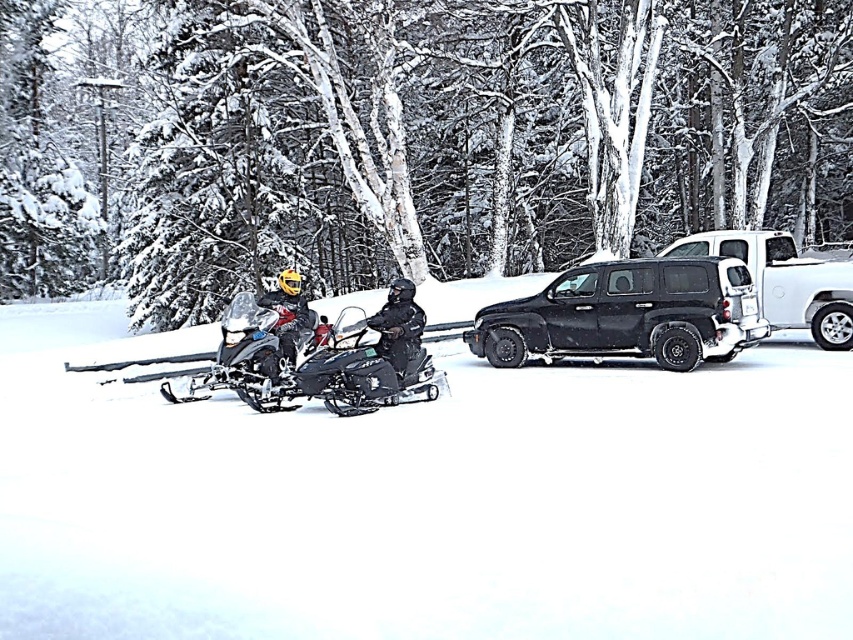
Is black matte suv at center taller than white glossy trailer truck at center right?

Incorrect, black matte suv at center's height is not larger of white glossy trailer truck at center right's.

Does point (515, 314) lie behind point (761, 308)?

That is False.

Locate an element on the screen. The height and width of the screenshot is (640, 853). black matte suv at center is located at coordinates (627, 314).

From the picture: Does shiny black snowmobile at center have a greater width compared to matte black snowmobile at center?

No, shiny black snowmobile at center is not wider than matte black snowmobile at center.

Is point (397, 380) in front of point (287, 364)?

That is True.

Is point (335, 371) closer to camera compared to point (286, 268)?

Yes, point (335, 371) is closer to viewer.

Image resolution: width=853 pixels, height=640 pixels. I want to click on shiny black snowmobile at center, so 364,369.

Does shiny silver snowmobile at center have a lesser height compared to matte black snowmobile at center?

Yes.

Can you confirm if shiny silver snowmobile at center is thinner than matte black snowmobile at center?

Indeed, shiny silver snowmobile at center has a lesser width compared to matte black snowmobile at center.

At what (x,y) coordinates should I click in order to perform the action: click on shiny silver snowmobile at center. Please return your answer as a coordinate pair (x, y). Looking at the image, I should click on (334, 358).

You are a GUI agent. You are given a task and a screenshot of the screen. Output one action in this format:
    pyautogui.click(x=<x>, y=<y>)
    Task: Click on the shiny silver snowmobile at center
    The height and width of the screenshot is (640, 853).
    Given the screenshot: What is the action you would take?
    pyautogui.click(x=334, y=358)